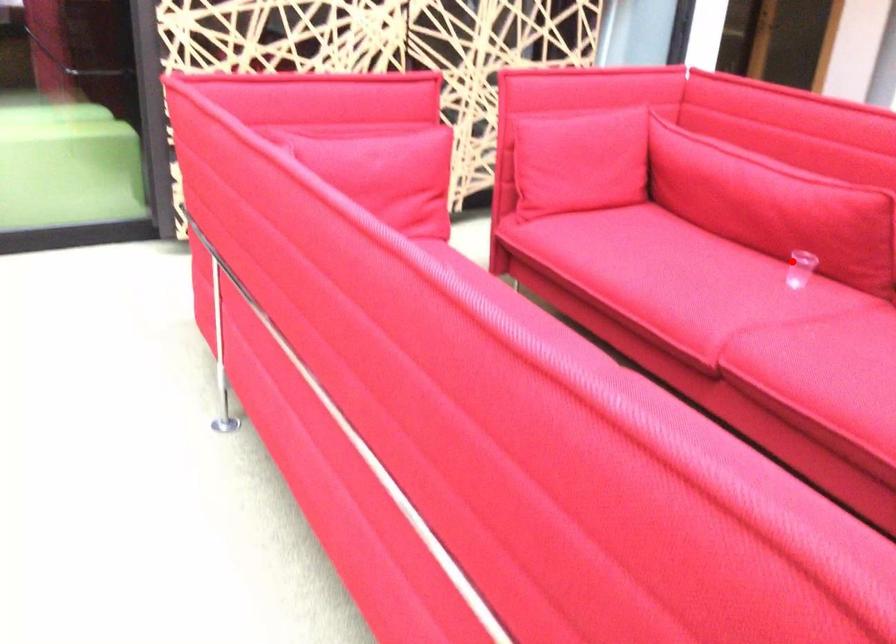
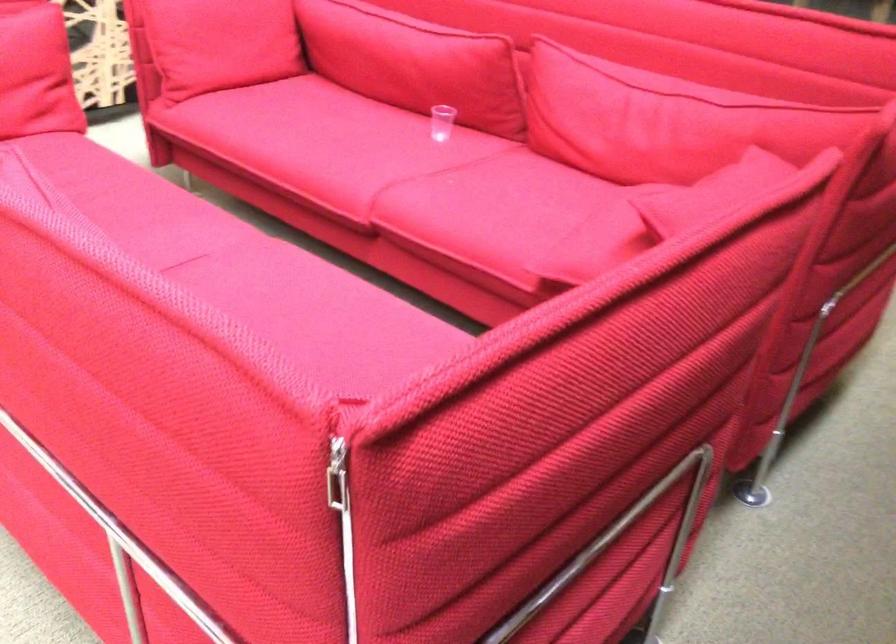
The point at the highlighted location is marked in the first image. Where is the corresponding point in the second image?

(442, 122)